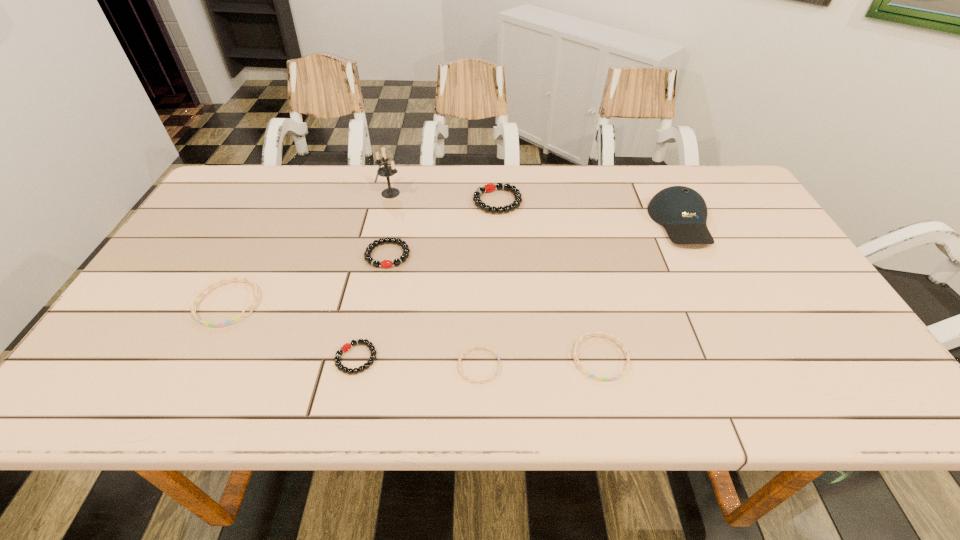
Locate an element on the screen. The height and width of the screenshot is (540, 960). blank region between the third farthest bracelet and the second farthest black bracelet is located at coordinates (308, 279).

This screenshot has height=540, width=960. I want to click on empty location between the farthest black bracelet and the tallest object, so click(x=444, y=197).

Where is `object that is the fifth closest to the shortest bracelet`? object that is the fifth closest to the shortest bracelet is located at coordinates (236, 318).

Where is `object that is the seventh closest one to the smallest black bracelet`? The width and height of the screenshot is (960, 540). object that is the seventh closest one to the smallest black bracelet is located at coordinates (682, 211).

The image size is (960, 540). In order to click on bracelet object that ranks as the second closest to the second tallest object in this screenshot , I will do `click(490, 187)`.

Locate which bracelet is the second closest to the second tallest object. Please provide its 2D coordinates. Your answer should be formatted as a tuple, i.e. [(x, y)], where the tuple contains the x and y coordinates of a point satisfying the conditions above.

[(490, 187)]

Identify the location of black bracelet that is the second closest to the farthest black bracelet. (347, 346).

Identify the location of the closest black bracelet to the farthest bracelet. (367, 254).

Find the location of a particular element. Image resolution: width=960 pixels, height=540 pixels. blue bracelet that is the second closest one to the candle holder is located at coordinates (476, 347).

Identify which blue bracelet is the closest to the second smallest blue bracelet. Please provide its 2D coordinates. Your answer should be formatted as a tuple, i.e. [(x, y)], where the tuple contains the x and y coordinates of a point satisfying the conditions above.

[(476, 347)]